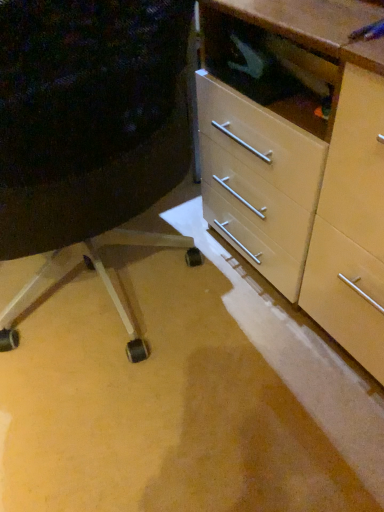
Locate an element on the screen. The width and height of the screenshot is (384, 512). vacant area in front of matte plastic drawer at center-right is located at coordinates (152, 444).